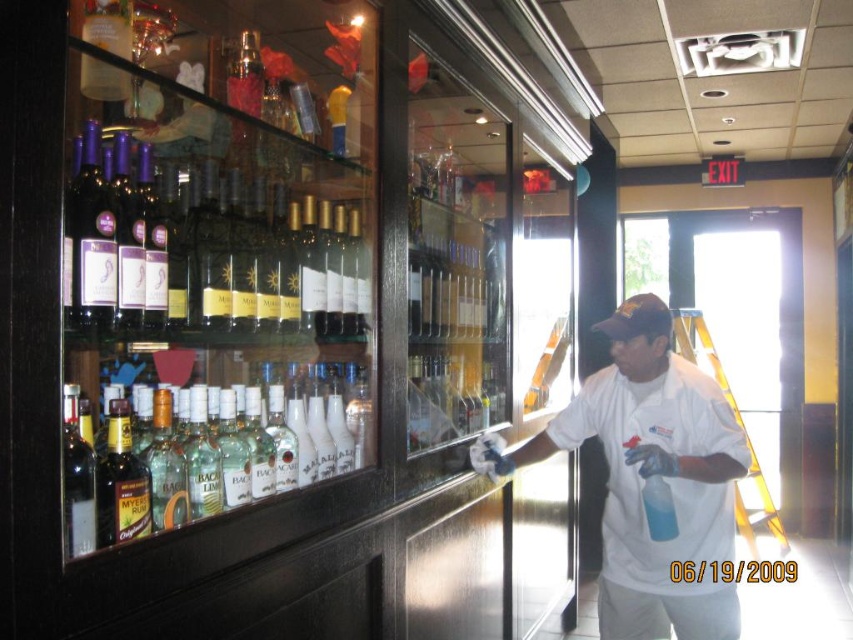
Between point (697, 458) and point (74, 458), which one is positioned behind?

Positioned behind is point (697, 458).

Which is in front, point (728, 538) or point (73, 444)?

Point (73, 444)

Find the location of a particular element. The image size is (853, 640). white cloth shirt at right is located at coordinates click(650, 477).

Who is more distant from viewer, (637, 406) or (131, 451)?

Positioned behind is point (637, 406).

Does white cloth shirt at right appear on the right side of clear glass bottles at center?

Yes, white cloth shirt at right is to the right of clear glass bottles at center.

The width and height of the screenshot is (853, 640). Describe the element at coordinates (650, 477) in the screenshot. I see `white cloth shirt at right` at that location.

Find the location of a particular element. The image size is (853, 640). white cloth shirt at right is located at coordinates (650, 477).

Who is positioned more to the left, matte purple wine at upper left or clear glass bottles at center?

From the viewer's perspective, matte purple wine at upper left appears more on the left side.

Does matte purple wine at upper left lie in front of clear glass bottles at center?

No, it is behind clear glass bottles at center.

Is point (341, 172) more distant than point (107, 387)?

That is True.

Where is `matte purple wine at upper left`? This screenshot has width=853, height=640. matte purple wine at upper left is located at coordinates (192, 237).